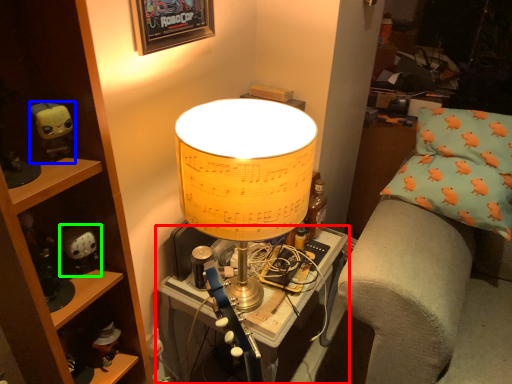
Question: Which object is the closest to the table (highlighted by a red box)? Choose among these: toy (highlighted by a blue box) or toy (highlighted by a green box).

Choices:
 (A) toy
 (B) toy

Answer: (B)